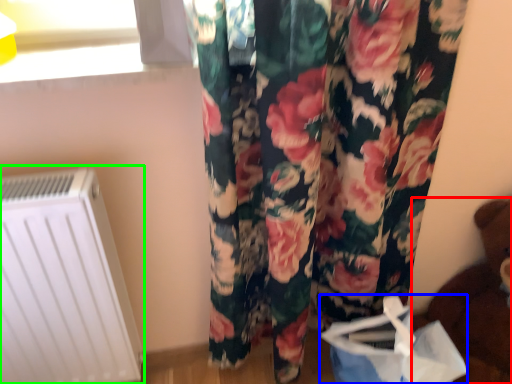
Question: Which is farther away from toy (highlighted by a red box)? shopping bag (highlighted by a blue box) or radiator (highlighted by a green box)?

Choices:
 (A) shopping bag
 (B) radiator

Answer: (B)